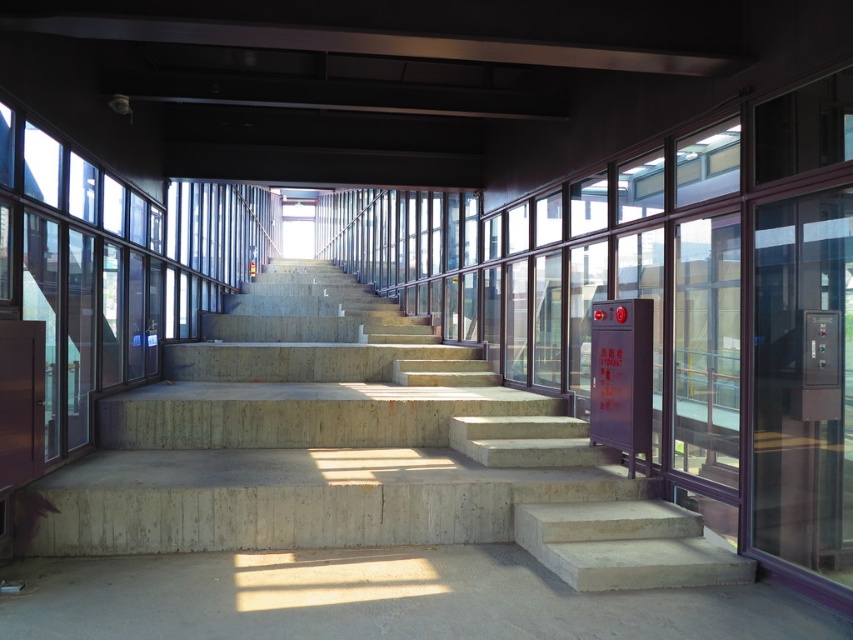
Is concrete stairs at center behind transparent glass door at right?

That is True.

Which is more to the left, concrete stairs at center or transparent glass door at right?

Positioned to the left is concrete stairs at center.

The height and width of the screenshot is (640, 853). What do you see at coordinates (357, 452) in the screenshot?
I see `concrete stairs at center` at bounding box center [357, 452].

You are a GUI agent. You are given a task and a screenshot of the screen. Output one action in this format:
    pyautogui.click(x=<x>, y=<y>)
    Task: Click on the concrete stairs at center
    The image size is (853, 640).
    Given the screenshot: What is the action you would take?
    pyautogui.click(x=357, y=452)

Does gray concrete steps at center appear over transparent glass door at right?

No, gray concrete steps at center is not above transparent glass door at right.

Can you confirm if gray concrete steps at center is shorter than transparent glass door at right?

Correct, gray concrete steps at center is not as tall as transparent glass door at right.

This screenshot has height=640, width=853. What do you see at coordinates (378, 600) in the screenshot? I see `gray concrete steps at center` at bounding box center [378, 600].

The image size is (853, 640). I want to click on gray concrete steps at center, so click(x=378, y=600).

Does concrete stairs at center appear over gray concrete steps at center?

Indeed, concrete stairs at center is positioned over gray concrete steps at center.

Is concrete stairs at center to the left of gray concrete steps at center from the viewer's perspective?

Correct, you'll find concrete stairs at center to the left of gray concrete steps at center.

Does point (380, 356) come closer to viewer compared to point (654, 620)?

No.

Find the location of a particular element. This screenshot has width=853, height=640. concrete stairs at center is located at coordinates (357, 452).